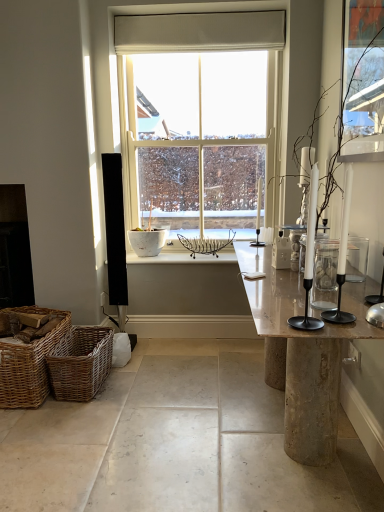
Identify the location of free location to the left of marble table at center. The image size is (384, 512). (x=153, y=424).